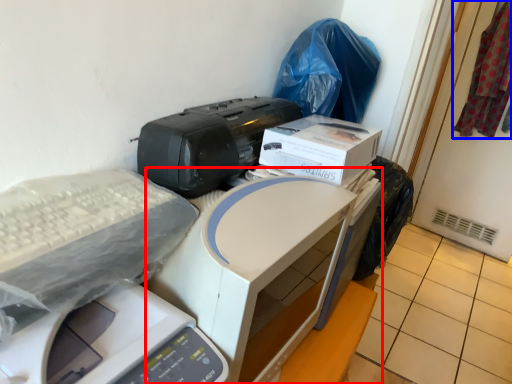
Question: Which object appears closest to the camera in this image, printer (highlighted by a red box) or material (highlighted by a blue box)?

Choices:
 (A) printer
 (B) material

Answer: (A)